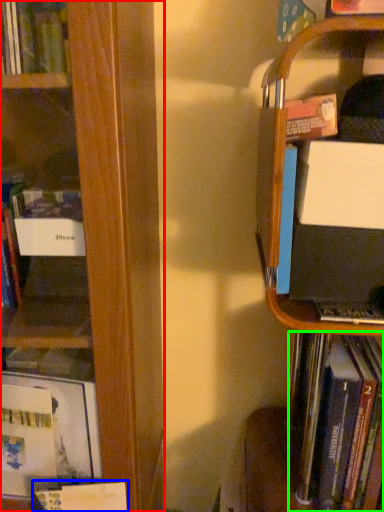
Question: Considering the real-world distances, which object is closest to book (highlighted by a red box)? book (highlighted by a blue box) or book (highlighted by a green box).

Choices:
 (A) book
 (B) book

Answer: (A)